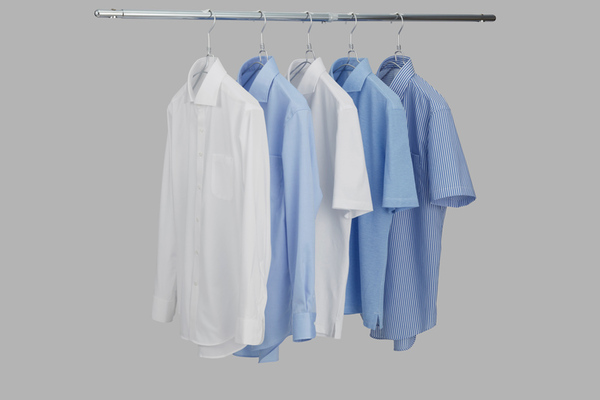
Find the location of a particular element. clothes hangers is located at coordinates (209, 29), (261, 28), (310, 31), (352, 34), (399, 42).